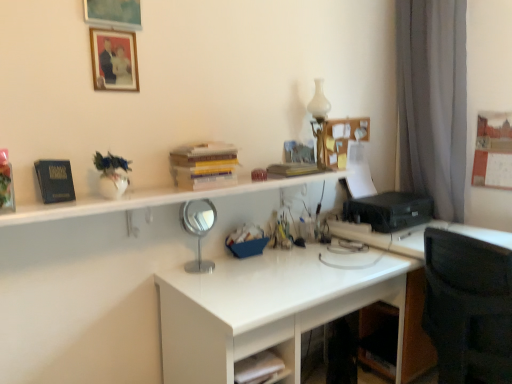
Image resolution: width=512 pixels, height=384 pixels. Describe the element at coordinates (113, 14) in the screenshot. I see `matte wooden picture frame at upper center, the second picture frame ordered from the bottom` at that location.

This screenshot has width=512, height=384. Describe the element at coordinates (55, 180) in the screenshot. I see `hardcover book at left, placed as the first book when sorted from left to right` at that location.

Image resolution: width=512 pixels, height=384 pixels. What do you see at coordinates (247, 241) in the screenshot?
I see `blue plastic container at center` at bounding box center [247, 241].

At what (x,y) coordinates should I click in order to perform the action: click on white matte drawer at lower center. Please return your answer as a coordinate pair (x, y). This screenshot has height=384, width=512. Looking at the image, I should click on (263, 337).

In order to face white matte drawer at lower center, should I rotate leftwards or rightwards?

You should look left and rotate roughly 1.421 degrees.

The height and width of the screenshot is (384, 512). What are the coordinates of `black plastic printer at right` in the screenshot? It's located at (390, 210).

Can you confirm if matte wooden picture frame at upper center, the second picture frame ordered from the bottom, is taller than hardcover books at upper center, marked as the second book in a back-to-front arrangement?

Yes, matte wooden picture frame at upper center, the second picture frame ordered from the bottom, is taller than hardcover books at upper center, marked as the second book in a back-to-front arrangement.

Is matte wooden picture frame at upper center, the second picture frame ordered from the bottom, further to camera compared to hardcover books at upper center, marked as the second book in a left-to-right arrangement?

That is False.

In the scene shown: Which object is wider, matte wooden picture frame at upper center, which is the 1th picture frame in top-to-bottom order, or hardcover books at upper center, marked as the second book in a left-to-right arrangement?

Wider between the two is hardcover books at upper center, marked as the second book in a left-to-right arrangement.

From the image's perspective, starting from the hardcover books at upper center, arranged as the second book when viewed from the right, which picture frame is the 2nd one above? Please provide its 2D coordinates.

[(113, 14)]

The image size is (512, 384). Find the location of `the 1st book in front of the black plastic printer at right, counting from the anchor's position`. the 1st book in front of the black plastic printer at right, counting from the anchor's position is located at coordinates (293, 169).

Is the position of black plastic printer at right less distant than that of hardcover book at upper center, arranged as the 3th book when viewed from the front?

No, the depth of black plastic printer at right is greater than that of hardcover book at upper center, arranged as the 3th book when viewed from the front.

Is black plastic printer at right oriented away from hardcover book at upper center, which appears as the 1th book when viewed from the right?

No, hardcover book at upper center, which appears as the 1th book when viewed from the right, is not at the back of black plastic printer at right.

Which of these two, black plastic printer at right or hardcover book at upper center, arranged as the third book when viewed from the left, is thinner?

With smaller width is hardcover book at upper center, arranged as the third book when viewed from the left.

Between hardcover book at upper center, which appears as the 1th book when viewed from the right, and white matte drawer at lower center, which one is positioned behind?

hardcover book at upper center, which appears as the 1th book when viewed from the right, is further away from the camera.

Could you tell me if hardcover book at upper center, which appears as the 1th book when viewed from the right, is facing white matte drawer at lower center?

No, hardcover book at upper center, which appears as the 1th book when viewed from the right, does not turn towards white matte drawer at lower center.

Is hardcover book at upper center, which appears as the 1th book when viewed from the right, bigger or smaller than white matte drawer at lower center?

In the image, hardcover book at upper center, which appears as the 1th book when viewed from the right, appears to be smaller than white matte drawer at lower center.

Considering the sizes of objects hardcover book at upper center, which appears as the 1th book when viewed from the right, and white matte drawer at lower center in the image provided, who is taller, hardcover book at upper center, which appears as the 1th book when viewed from the right, or white matte drawer at lower center?

With more height is hardcover book at upper center, which appears as the 1th book when viewed from the right.

Can you confirm if matte wooden picture frame at upper center, the second picture frame ordered from the bottom, is wider than matte wooden picture frame at upper center, which is the 2th picture frame from top to bottom?

Yes.

Is matte wooden picture frame at upper center, the first picture frame from the bottom, a part of matte wooden picture frame at upper center, the second picture frame ordered from the bottom?

No, matte wooden picture frame at upper center, the first picture frame from the bottom, is not a part of matte wooden picture frame at upper center, the second picture frame ordered from the bottom.

Which point is more forward, (128, 2) or (131, 59)?

Point (128, 2)

Which object is further away from the camera taking this photo, matte wooden picture frame at upper center, the second picture frame ordered from the bottom, or matte wooden picture frame at upper center, which is the 2th picture frame from top to bottom?

Positioned behind is matte wooden picture frame at upper center, which is the 2th picture frame from top to bottom.

Is the position of white matte drawer at lower center more distant than that of blue plastic container at center?

No.

Is white matte drawer at lower center taller or shorter than blue plastic container at center?

In the image, white matte drawer at lower center appears to be shorter than blue plastic container at center.

Does point (261, 341) appear closer or farther from the camera than point (260, 238)?

Point (261, 341).

Does white glossy bookshelf at upper center have a smaller size compared to matte wooden picture frame at upper center, which is the 2th picture frame from top to bottom?

Actually, white glossy bookshelf at upper center might be larger than matte wooden picture frame at upper center, which is the 2th picture frame from top to bottom.

Considering the sizes of white glossy bookshelf at upper center and matte wooden picture frame at upper center, which is the 2th picture frame from top to bottom, in the image, is white glossy bookshelf at upper center wider or thinner than matte wooden picture frame at upper center, which is the 2th picture frame from top to bottom,?

In the image, white glossy bookshelf at upper center appears to be wider than matte wooden picture frame at upper center, which is the 2th picture frame from top to bottom.

Is white glossy bookshelf at upper center not close to matte wooden picture frame at upper center, the first picture frame from the bottom?

No, there isn't a large distance between white glossy bookshelf at upper center and matte wooden picture frame at upper center, the first picture frame from the bottom.

Is white glossy vase at upper right taller than blue plastic container at center?

Yes, white glossy vase at upper right is taller than blue plastic container at center.

Looking at this image, is white glossy vase at upper right bigger than blue plastic container at center?

Indeed, white glossy vase at upper right has a larger size compared to blue plastic container at center.

Can you tell me how much white glossy vase at upper right and blue plastic container at center differ in facing direction?

The angle between the facing direction of white glossy vase at upper right and the facing direction of blue plastic container at center is 1.08 degrees.

The width and height of the screenshot is (512, 384). In the image, there is a white glossy vase at upper right. Find the location of `stationery below it (from a real-world perspective)`. stationery below it (from a real-world perspective) is located at coordinates (247, 241).

You are a GUI agent. You are given a task and a screenshot of the screen. Output one action in this format:
    pyautogui.click(x=<x>, y=<y>)
    Task: Click on the 1st book below the matte wooden picture frame at upper center, the second picture frame ordered from the bottom (from a real-world perspective)
    
    Given the screenshot: What is the action you would take?
    pyautogui.click(x=204, y=165)

Which book is the 1st one when counting from the front of the black plastic printer at right? Please provide its 2D coordinates.

[(293, 169)]

When comparing their distances from matte wooden picture frame at upper center, the first picture frame from the bottom, does white matte drawer at lower center or blue plastic container at center seem further?

Among the two, white matte drawer at lower center is located further to matte wooden picture frame at upper center, the first picture frame from the bottom.

Looking at the image, which one is located further to white glossy vase at upper right, matte wooden picture frame at upper center, which is the 1th picture frame in top-to-bottom order, or white matte drawer at lower center?

white matte drawer at lower center.

Which object lies nearer to the anchor point blue plastic container at center, hardcover book at upper center, arranged as the third book when viewed from the left, or white matte drawer at lower center?

hardcover book at upper center, arranged as the third book when viewed from the left, is positioned closer to the anchor blue plastic container at center.

From the picture: When comparing their distances from black plastic printer at right, does matte wooden picture frame at upper center, the second picture frame ordered from the bottom, or white glossy desk at center seem further?

matte wooden picture frame at upper center, the second picture frame ordered from the bottom.

Which object lies nearer to the anchor point black plastic printer at right, white glossy bookshelf at upper center or white glossy desk at center?

white glossy desk at center lies closer to black plastic printer at right than the other object.

From the picture: Considering their positions, is blue plastic container at center positioned further to matte wooden picture frame at upper center, which is the 2th picture frame from top to bottom, than polished silver mirror at center?

The object further to matte wooden picture frame at upper center, which is the 2th picture frame from top to bottom, is blue plastic container at center.

Estimate the real-world distances between objects in this image. Which object is further from matte wooden picture frame at upper center, which is the 1th picture frame in top-to-bottom order, white glossy bookshelf at upper center or blue plastic container at center?

blue plastic container at center lies further to matte wooden picture frame at upper center, which is the 1th picture frame in top-to-bottom order, than the other object.

Based on their spatial positions, is hardcover book at left, the 3th book viewed from the back, or polished silver mirror at center further from matte wooden picture frame at upper center, which is the 1th picture frame in top-to-bottom order?

polished silver mirror at center is further to matte wooden picture frame at upper center, which is the 1th picture frame in top-to-bottom order.

Locate an element on the screen. desk situated between hardcover books at upper center, marked as the second book in a back-to-front arrangement, and black plastic printer at right from left to right is located at coordinates (275, 304).

Find the location of `drawer between polished silver mirror at center and black plastic printer at right from left to right`. drawer between polished silver mirror at center and black plastic printer at right from left to right is located at coordinates (263, 337).

The height and width of the screenshot is (384, 512). Identify the location of desk between hardcover book at left, placed as the first book when sorted from left to right, and black plastic printer at right. (275, 304).

Identify the location of printer between matte wooden picture frame at upper center, the second picture frame ordered from the bottom, and white glossy desk at center in the up-down direction. (390, 210).